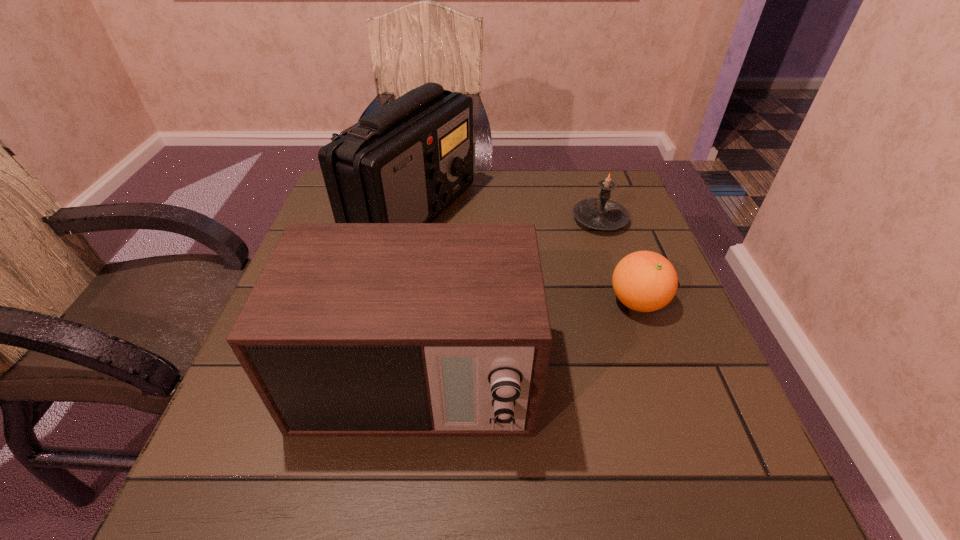
This screenshot has height=540, width=960. Find the location of `the farther radio receiver`. the farther radio receiver is located at coordinates (406, 162).

The image size is (960, 540). Find the location of `the tallest object`. the tallest object is located at coordinates (406, 162).

Image resolution: width=960 pixels, height=540 pixels. I want to click on the third shortest object, so click(x=352, y=329).

You are a GUI agent. You are given a task and a screenshot of the screen. Output one action in this format:
    pyautogui.click(x=<x>, y=<y>)
    Task: Click on the nearer radio receiver
    
    Given the screenshot: What is the action you would take?
    pyautogui.click(x=352, y=329)

The height and width of the screenshot is (540, 960). In order to click on candle in this screenshot , I will do `click(601, 213)`.

At what (x,y) coordinates should I click in order to perform the action: click on orange. Please return your answer as a coordinate pair (x, y). This screenshot has height=540, width=960. Looking at the image, I should click on (645, 281).

What are the coordinates of `vacant space located 0.230m on the front panel of the taller radio receiver` in the screenshot? It's located at (564, 212).

The image size is (960, 540). I want to click on free space located 0.060m on the front-facing side of the shorter radio receiver, so click(x=402, y=495).

This screenshot has width=960, height=540. Identify the location of vacant space located on the back of the candle. (590, 194).

What are the coordinates of `free region located on the back of the orange` in the screenshot? It's located at (602, 202).